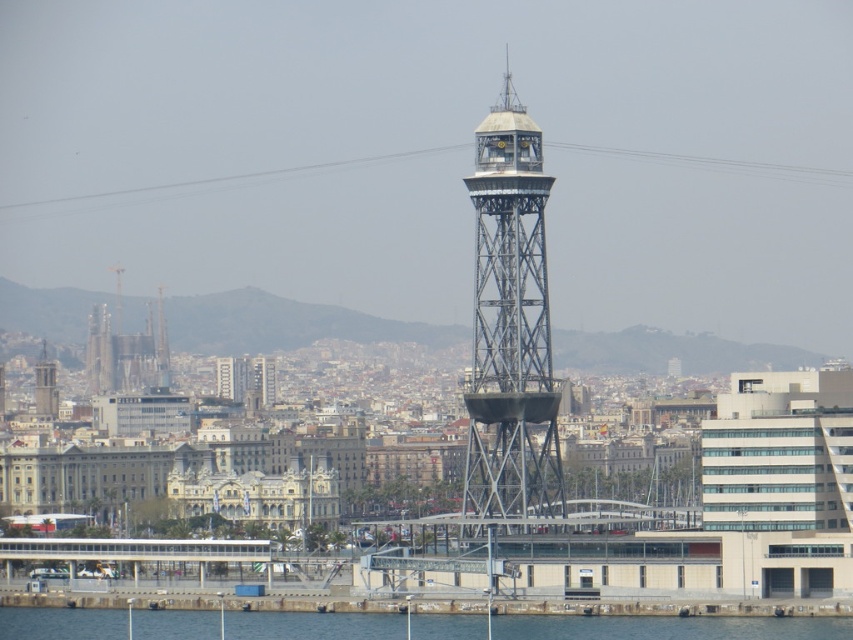
Based on the photo, who is positioned more to the left, clear blue water at lower center or matte gray tower at center?

Positioned to the left is matte gray tower at center.

Is clear blue water at lower center to the left of matte gray tower at center from the viewer's perspective?

No, clear blue water at lower center is not to the left of matte gray tower at center.

Is point (698, 637) closer to camera compared to point (96, 353)?

Yes, point (698, 637) is in front of point (96, 353).

Where is `clear blue water at lower center`? clear blue water at lower center is located at coordinates (669, 627).

Is metallic lattice tower at center shorter than matte gray tower at center?

No.

Is metallic lattice tower at center bigger than matte gray tower at center?

Correct, metallic lattice tower at center is larger in size than matte gray tower at center.

This screenshot has height=640, width=853. I want to click on metallic lattice tower at center, so click(x=509, y=324).

Which is behind, point (474, 483) or point (851, 620)?

Point (851, 620)

Can you confirm if metallic lattice tower at center is smaller than clear blue water at lower center?

Incorrect, metallic lattice tower at center is not smaller in size than clear blue water at lower center.

Who is more forward, (476, 172) or (318, 625)?

Positioned in front is point (476, 172).

The height and width of the screenshot is (640, 853). Find the location of `metallic lattice tower at center`. metallic lattice tower at center is located at coordinates coord(509,324).